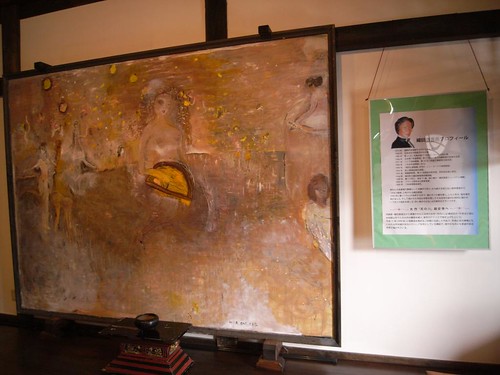
Where is `decorative wood`? The image size is (500, 375). decorative wood is located at coordinates click(x=12, y=13), click(x=15, y=59), click(x=52, y=7).